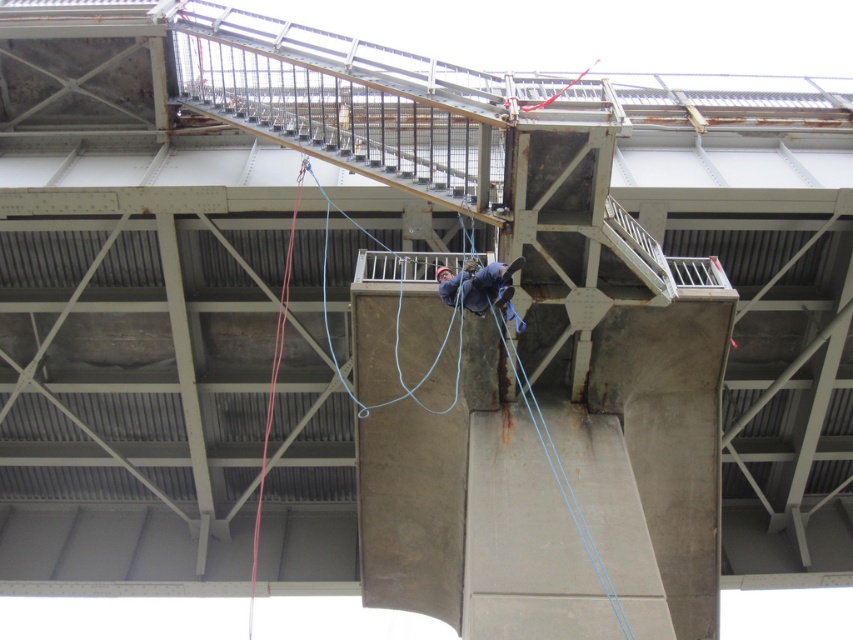
Question: Among these objects, which one is farthest from the camera?

Choices:
 (A) concrete/stained at center
 (B) red nylon rope at center
 (C) blue fabric harness at center

Answer: (B)

Question: Which point is closer to the camera taking this photo?

Choices:
 (A) (456, 275)
 (B) (276, 368)

Answer: (A)

Question: Does red nylon rope at center have a greater width compared to blue fabric harness at center?

Choices:
 (A) no
 (B) yes

Answer: (B)

Question: Which point appears farthest from the camera in this image?

Choices:
 (A) (494, 260)
 (B) (286, 272)

Answer: (B)

Question: Does red nylon rope at center appear over blue fabric harness at center?

Choices:
 (A) no
 (B) yes

Answer: (A)

Question: Is concrete/stained at center in front of red nylon rope at center?

Choices:
 (A) no
 (B) yes

Answer: (B)